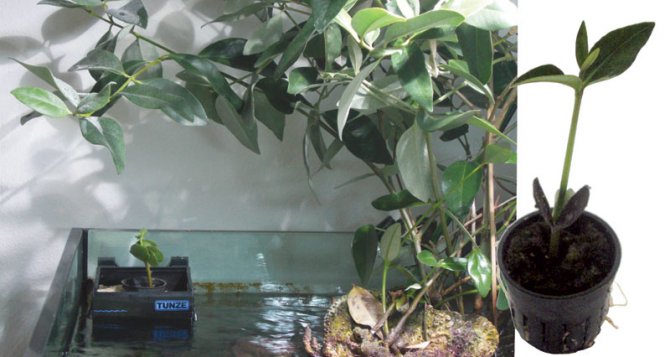
This screenshot has height=357, width=670. Find the location of `wall`. wall is located at coordinates (187, 164).